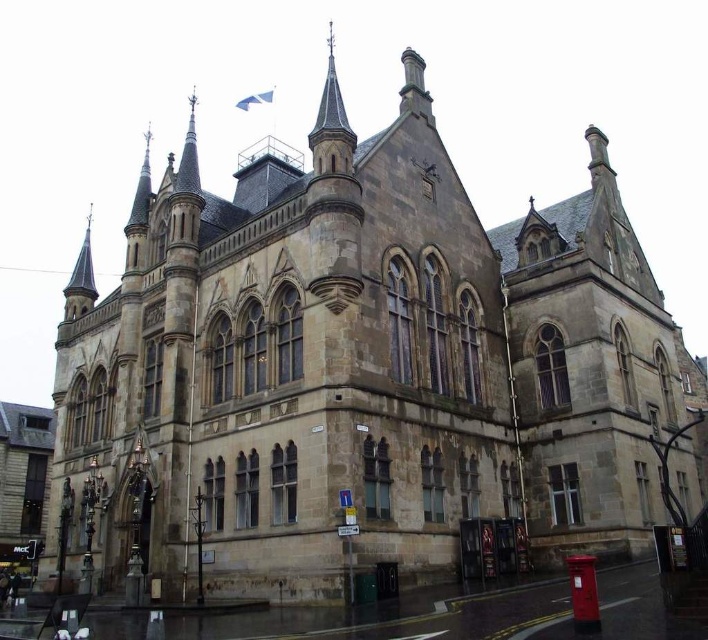
Question: Does dark brown stone spire at upper center have a lesser width compared to smooth gray spire at upper left?

Choices:
 (A) yes
 (B) no

Answer: (A)

Question: Among these points, which one is nearest to the camera?

Choices:
 (A) (86, 300)
 (B) (326, 140)

Answer: (B)

Question: Does dark brown stone spire at upper center appear on the left side of smooth gray spire at upper left?

Choices:
 (A) no
 (B) yes

Answer: (A)

Question: Does dark brown stone spire at upper center appear on the right side of smooth gray spire at upper left?

Choices:
 (A) yes
 (B) no

Answer: (A)